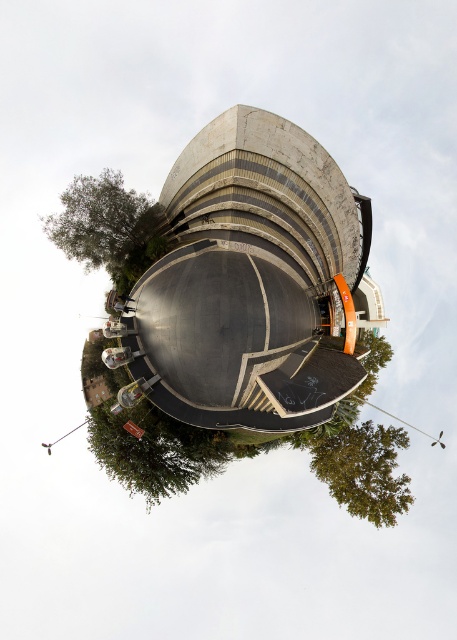
What is the 2D coordinate of the green leafy tree at upper left in the image?

The green leafy tree at upper left is located at the 2D coordinate point of (107,227).

You are standing in the center of the parking structure and want to exit towards the green leafy tree at upper left and the green leafy tree at lower right. Which direction should you walk to reach the tree that is further to your left?

The green leafy tree at upper left is to the left of green leafy tree at lower right, so you should walk towards the green leafy tree at upper left to reach the tree that is further to your left.